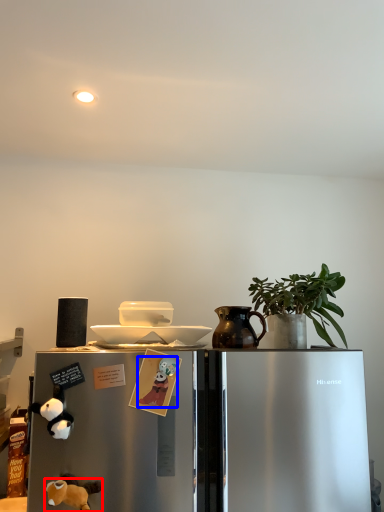
Question: Which object appears closest to the camera in this image, animal (highlighted by a red box) or animal (highlighted by a blue box)?

Choices:
 (A) animal
 (B) animal

Answer: (A)